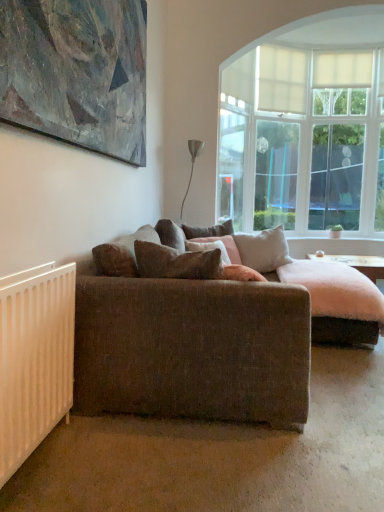
Question: From a real-world perspective, is brown fabric pillow at center, which is the 1th pillow from front to back, positioned above or below brown fabric pillow at center, the 4th pillow positioned from the front?

Choices:
 (A) below
 (B) above

Answer: (B)

Question: Is brown fabric pillow at center, which ranks as the 4th pillow in back-to-front order, in front of or behind brown fabric pillow at center, the 4th pillow positioned from the front, in the image?

Choices:
 (A) front
 (B) behind

Answer: (A)

Question: Considering the real-world distances, which object is closest to the white matte radiator at lower left?

Choices:
 (A) metallic silver lamp at upper center
 (B) translucent glass door at upper right
 (C) brown fabric pillow at center, which is the third pillow in back-to-front order
 (D) white sheer curtain at upper center
 (E) light beige fabric pillow at center, arranged as the 2th pillow when viewed from the back

Answer: (C)

Question: Which object is positioned farthest from the felt-like pink coffee table at center?

Choices:
 (A) light beige fabric pillow at center, which is the 3th pillow in front-to-back order
 (B) textured brown couch at center
 (C) brown fabric pillow at center, arranged as the 2th pillow when viewed from the front
 (D) translucent glass door at upper right
 (E) white matte radiator at lower left

Answer: (E)